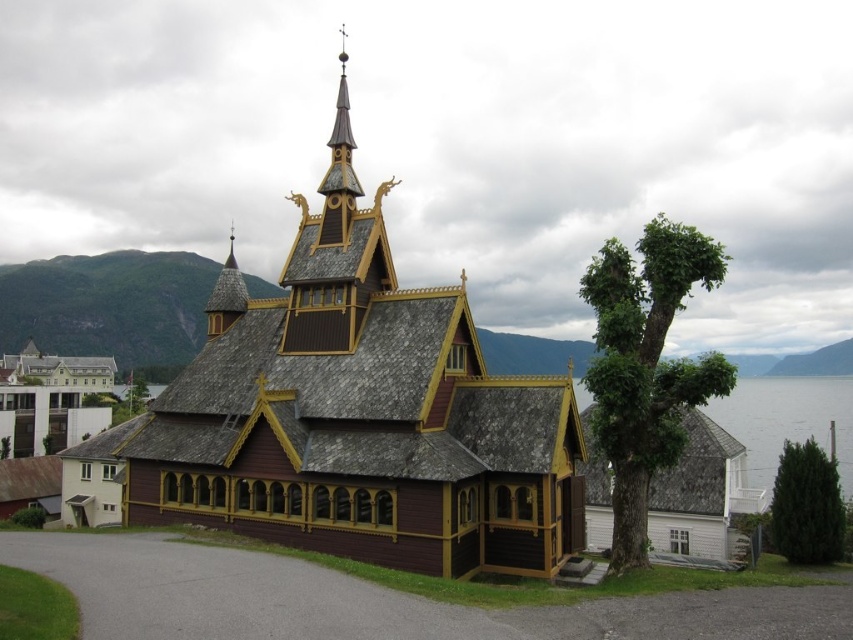
You are standing in the courtyard of the Norwegian stave church complex and need to locate both the brown wooden chapel at center and the brown wooden church at lower left. From your current position, which direction should you face to have both structures in your field of view?

To have both the brown wooden chapel at center and the brown wooden church at lower left in your field of view, you should face towards the right side since the brown wooden chapel at center is to the right of the brown wooden church at lower left.

You are standing in a field and see both the brown wooden chapel at center and the brown wooden church at lower left. Which one is closer to you?

The brown wooden chapel at center is closer to you because it is in front of the brown wooden church at lower left.